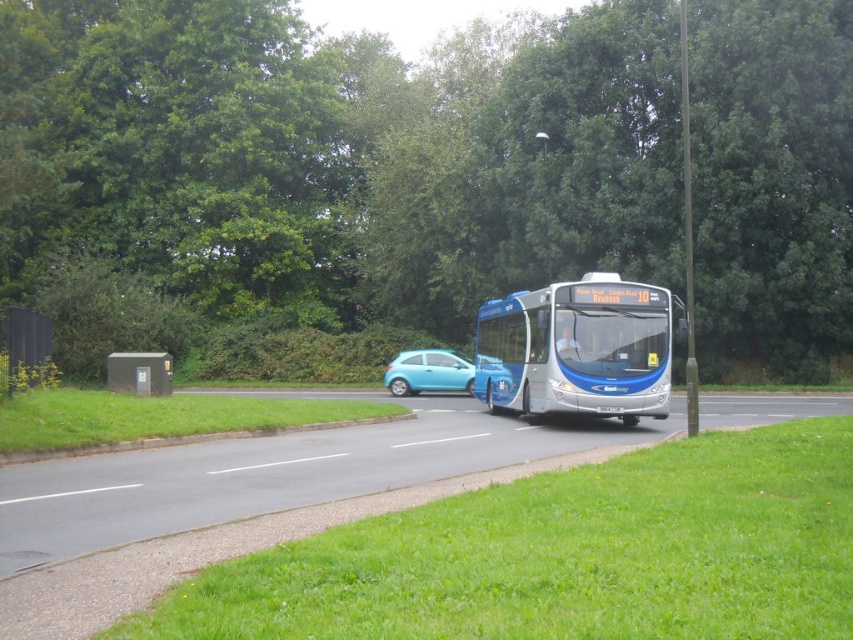
You are a pedestrian standing on the sidewalk next to the road. You see the blue metallic bus at center and the light blue glossy hatchback at center approaching you. Which vehicle will you need to move out of the way faster?

The blue metallic bus at center has a larger width than the light blue glossy hatchback at center, so you should move out of the way faster for the blue metallic bus at center since it occupies more space and may require more clearance.

You are a delivery person who needs to park your light blue glossy hatchback at center near the metallic gray bus stop at lower left. Is there enough space between them to open the trunk of your car?

The light blue glossy hatchback at center is smaller than the metallic gray bus stop at lower left, so there should be enough space to open the trunk between them.

You are a pedestrian trying to cross the road. You see a light blue glossy hatchback at center and a metallic gray bus stop at lower left. Which object is narrower, and can you safely cross between them if the hatchback is stopped?

The light blue glossy hatchback at center is narrower than the metallic gray bus stop at lower left. If the hatchback is stopped, there might be enough space to cross between them, but caution is advised as the bus stop is wider and the exact distance isn